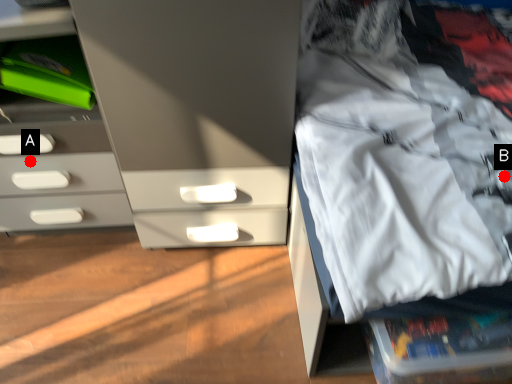
Question: Two points are circled on the image, labeled by A and B beside each circle. Which point is farther to the camera?

Choices:
 (A) A is further
 (B) B is further

Answer: (A)